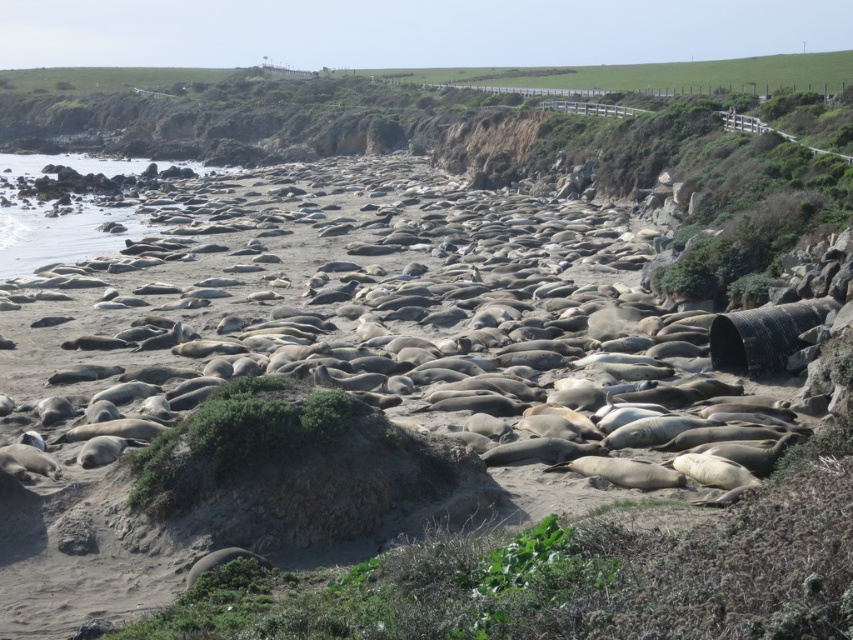
You are standing on the beach and see the gray matte seal at center and the gray matte seal at lower left. Which seal is positioned to the left when facing the ocean?

The gray matte seal at center is positioned to the left of the gray matte seal at lower left when facing the ocean.

You are a wildlife photographer trying to capture a closeup of the gray matte seal at center and the gray matte seal at lower left. Since you need to focus on both seals in the same frame, will the height difference between them affect your ability to do so?

The gray matte seal at center is taller than the gray matte seal at lower left, but since both are within the same frame, the height difference won

In the scene shown: You are a wildlife photographer aiming to capture the largest seal in the image. You see two seals, the gray matte seal at center and the gray matte seal at lower left. Which one should you focus on?

The gray matte seal at center is larger in width than the gray matte seal at lower left, so you should focus on the gray matte seal at center to capture the largest seal.